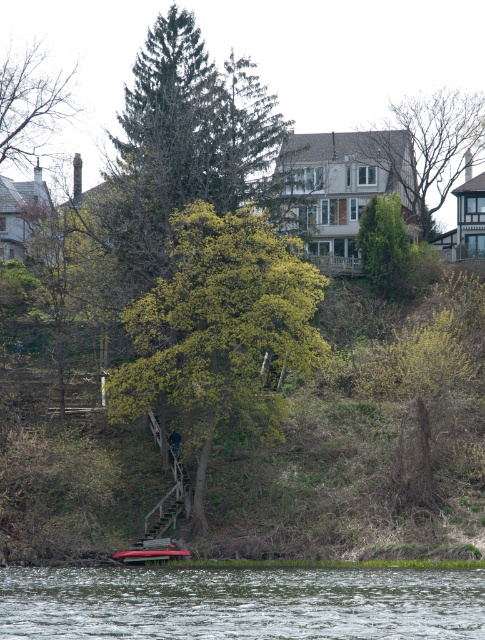
Does green leafy tree at center have a greater height compared to metallic silver boat at lower center?

Yes.

Who is shorter, green leafy tree at center or metallic silver boat at lower center?

With less height is metallic silver boat at lower center.

The height and width of the screenshot is (640, 485). Find the location of `green leafy tree at center`. green leafy tree at center is located at coordinates (221, 330).

Is green textured evergreen tree at center above metallic silver boat at lower center?

Yes.

Is the position of green textured evergreen tree at center more distant than that of metallic silver boat at lower center?

Yes, green textured evergreen tree at center is behind metallic silver boat at lower center.

Identify the location of green textured evergreen tree at center. (385, 244).

Is the position of green leafy tree at center more distant than that of clear water at lower center?

Yes, it is.

Is point (133, 372) positioned before point (49, 627)?

No, it is not.

Is point (179, 280) in front of point (7, 609)?

That is False.

Locate an element on the screen. This screenshot has width=485, height=640. green leafy tree at center is located at coordinates (221, 330).